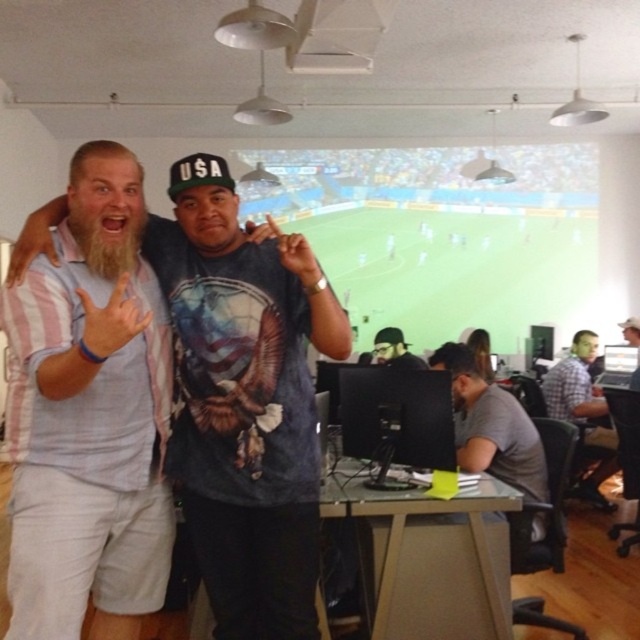
Question: Does gray matte shirt at center have a smaller size compared to dark gray knit cap at center?

Choices:
 (A) no
 (B) yes

Answer: (A)

Question: Which of the following is the farthest from the observer?

Choices:
 (A) white striped shirt at left
 (B) gray matte shirt at center
 (C) light blue striped shirt at center

Answer: (B)

Question: Which point is closer to the camera?

Choices:
 (A) (221, 429)
 (B) (576, 417)
 (C) (42, 333)

Answer: (C)

Question: Which of the following is the farthest from the observer?

Choices:
 (A) light blue striped shirt at center
 (B) plaid shirt at right
 (C) gray matte shirt at center
 (D) white striped shirt at left

Answer: (B)

Question: From the image, what is the correct spatial relationship of light blue striped shirt at center in relation to plaid shirt at right?

Choices:
 (A) left
 (B) right

Answer: (A)

Question: Is plaid shirt at right further to the viewer compared to dark gray knit cap at center?

Choices:
 (A) no
 (B) yes

Answer: (A)